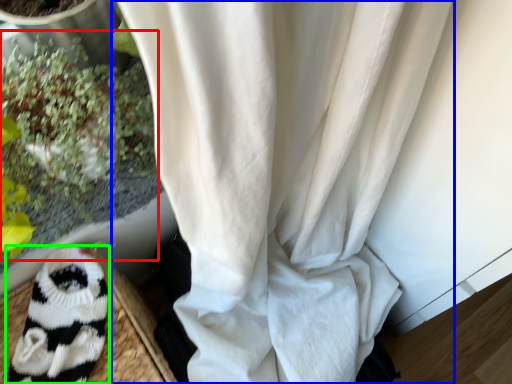
Question: Estimate the real-world distances between objects in this image. Which object is closer to floral arrangement (highlighted by a red box), curtain (highlighted by a blue box) or animal (highlighted by a green box)?

Choices:
 (A) curtain
 (B) animal

Answer: (B)